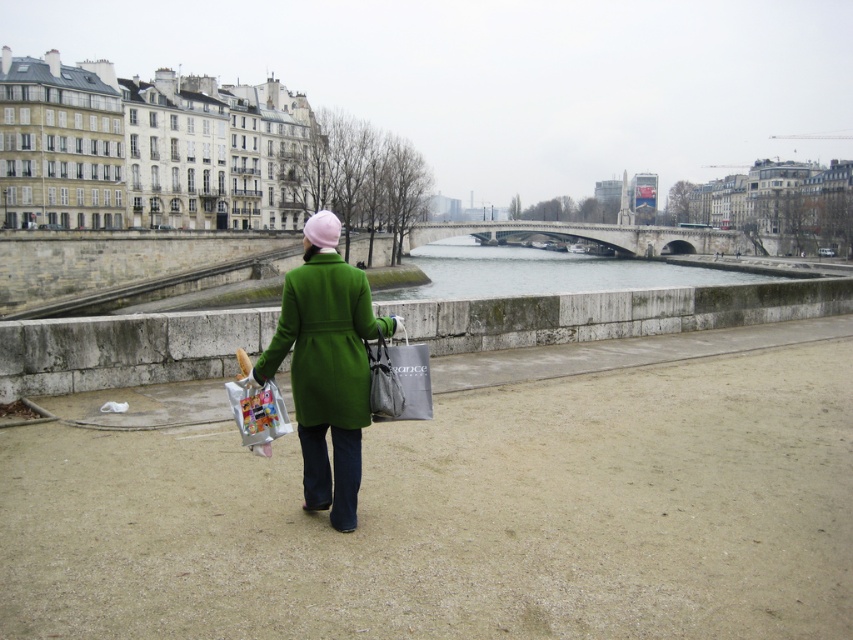
Question: Is green matte coat at center positioned before matte gray bag at center?

Choices:
 (A) no
 (B) yes

Answer: (B)

Question: Is green matte coat at center to the right of clear water at center from the viewer's perspective?

Choices:
 (A) no
 (B) yes

Answer: (A)

Question: Considering the real-world distances, which object is farthest from the green matte coat at center?

Choices:
 (A) matte gray bag at center
 (B) clear water at center

Answer: (B)

Question: Which object is closer to the camera taking this photo?

Choices:
 (A) green matte coat at center
 (B) clear water at center
 (C) matte gray bag at center

Answer: (A)

Question: Which of the following is the farthest from the observer?

Choices:
 (A) (318, 282)
 (B) (436, 248)
 (C) (416, 401)

Answer: (B)

Question: Is clear water at center to the right of matte gray bag at center from the viewer's perspective?

Choices:
 (A) yes
 (B) no

Answer: (A)